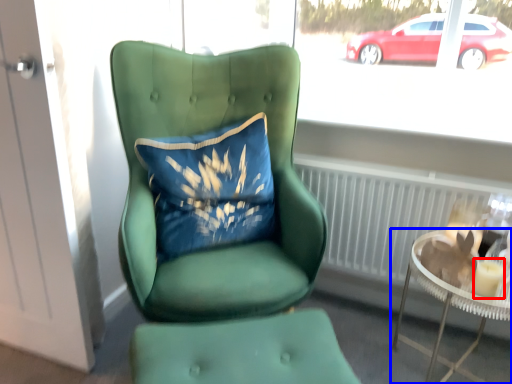
Question: Which of the following is the farthest to the observer, candle holder (highlighted by a red box) or table (highlighted by a blue box)?

Choices:
 (A) candle holder
 (B) table

Answer: (A)